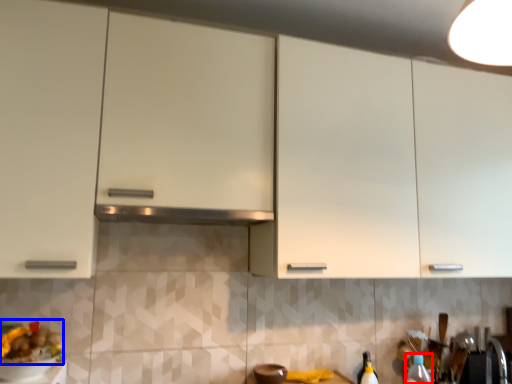
Question: Which object is further to the camera taking this photo, bottle (highlighted by a red box) or food (highlighted by a blue box)?

Choices:
 (A) bottle
 (B) food

Answer: (A)